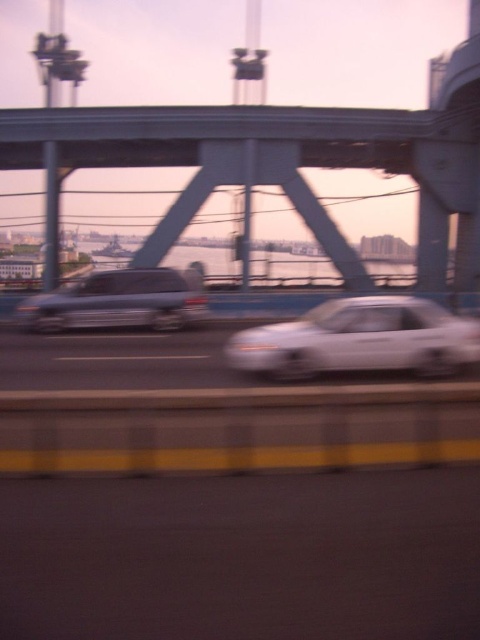
Can you confirm if metallic gray bridge at center is bigger than white glossy sedan at center?

Correct, metallic gray bridge at center is larger in size than white glossy sedan at center.

At what (x,y) coordinates should I click in order to perform the action: click on metallic gray bridge at center. Please return your answer as a coordinate pair (x, y). This screenshot has width=480, height=640. Looking at the image, I should click on (277, 163).

Can you confirm if metallic gray bridge at center is positioned above satin silver van at center?

Yes.

Is metallic gray bridge at center taller than satin silver van at center?

Yes.

Which is in front, point (440, 243) or point (189, 310)?

Positioned in front is point (189, 310).

I want to click on metallic gray bridge at center, so click(277, 163).

Can you confirm if white glossy sedan at center is positioned to the right of satin silver van at center?

Correct, you'll find white glossy sedan at center to the right of satin silver van at center.

This screenshot has width=480, height=640. What do you see at coordinates (360, 339) in the screenshot?
I see `white glossy sedan at center` at bounding box center [360, 339].

The width and height of the screenshot is (480, 640). In order to click on white glossy sedan at center in this screenshot , I will do `click(360, 339)`.